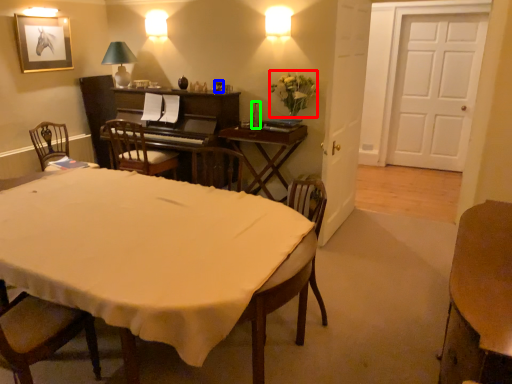
Question: Which is farther away from flower (highlighted by a red box)? wine glass (highlighted by a blue box) or bottle (highlighted by a green box)?

Choices:
 (A) wine glass
 (B) bottle

Answer: (A)